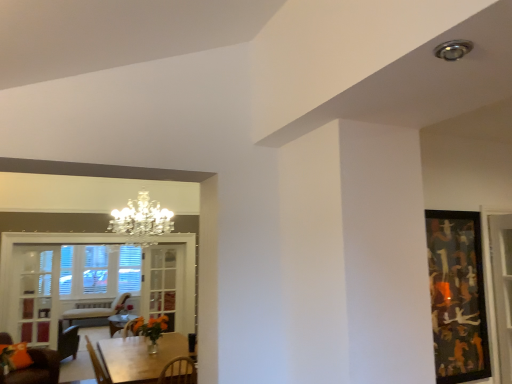
Question: Does clear glass cabinet at left, placed as the 1th glass door when sorted from left to right, lie behind clear glass window at lower left?

Choices:
 (A) no
 (B) yes

Answer: (B)

Question: From the image's perspective, is clear glass cabinet at left, acting as the 2th glass door starting from the right, beneath clear glass window at lower left?

Choices:
 (A) yes
 (B) no

Answer: (A)

Question: Is clear glass window at lower left a part of clear glass cabinet at left, placed as the 1th glass door when sorted from left to right?

Choices:
 (A) no
 (B) yes

Answer: (A)

Question: Could you tell me if clear glass cabinet at left, acting as the 1th glass door starting from the front, is facing clear glass window at lower left?

Choices:
 (A) yes
 (B) no

Answer: (A)

Question: From a real-world perspective, is clear glass cabinet at left, placed as the 1th glass door when sorted from left to right, located higher than clear glass window at lower left?

Choices:
 (A) no
 (B) yes

Answer: (A)

Question: Considering the positions of velvet orange cushion at lower left and abstract painting at right in the image, is velvet orange cushion at lower left wider or thinner than abstract painting at right?

Choices:
 (A) thin
 (B) wide

Answer: (B)

Question: Is velvet orange cushion at lower left taller or shorter than abstract painting at right?

Choices:
 (A) tall
 (B) short

Answer: (B)

Question: Is velvet orange cushion at lower left bigger or smaller than abstract painting at right?

Choices:
 (A) big
 (B) small

Answer: (A)

Question: From the image's perspective, is velvet orange cushion at lower left located above or below abstract painting at right?

Choices:
 (A) below
 (B) above

Answer: (A)

Question: Does point (106, 359) appear closer or farther from the camera than point (154, 299)?

Choices:
 (A) farther
 (B) closer

Answer: (B)

Question: Would you say wooden table at lower left is to the left or to the right of clear glass door at center, the first glass door in the right-to-left sequence, in the picture?

Choices:
 (A) right
 (B) left

Answer: (A)

Question: Based on their sizes in the image, would you say wooden table at lower left is bigger or smaller than clear glass door at center, the first glass door in the right-to-left sequence?

Choices:
 (A) small
 (B) big

Answer: (B)

Question: In terms of height, does wooden table at lower left look taller or shorter compared to clear glass door at center, placed as the second glass door when sorted from front to back?

Choices:
 (A) short
 (B) tall

Answer: (A)

Question: Is clear glass door at center, placed as the second glass door when sorted from front to back, wider or thinner than wooden table at lower left?

Choices:
 (A) wide
 (B) thin

Answer: (B)

Question: Is clear glass door at center, placed as the second glass door when sorted from front to back, inside the boundaries of wooden table at lower left, or outside?

Choices:
 (A) inside
 (B) outside

Answer: (B)